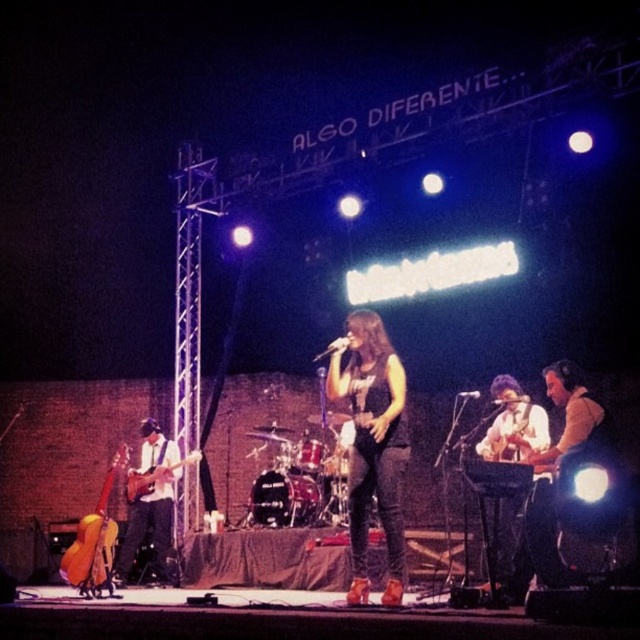
Looking at this image, does black leather pants at center lie in front of smooth brown guitar at center?

Yes, it is.

Which is in front, point (368, 484) or point (531, 433)?

Point (368, 484) is in front.

Where is `black leather pants at center`? The height and width of the screenshot is (640, 640). black leather pants at center is located at coordinates (372, 444).

Describe the element at coordinates (372, 444) in the screenshot. This screenshot has width=640, height=640. I see `black leather pants at center` at that location.

Does point (355, 472) come behind point (557, 493)?

Yes.

Does point (344, 348) come behind point (564, 420)?

No, (344, 348) is closer to viewer.

The image size is (640, 640). Find the location of `black leather pants at center`. black leather pants at center is located at coordinates (372, 444).

Does light brown leather jacket at right have a larger size compared to matte electric guitar at left?

Indeed, light brown leather jacket at right has a larger size compared to matte electric guitar at left.

Between light brown leather jacket at right and matte electric guitar at left, which one has less height?

Standing shorter between the two is matte electric guitar at left.

Is point (560, 483) more distant than point (132, 492)?

No, (560, 483) is closer to viewer.

In order to click on light brown leather jacket at right in this screenshot , I will do `click(564, 467)`.